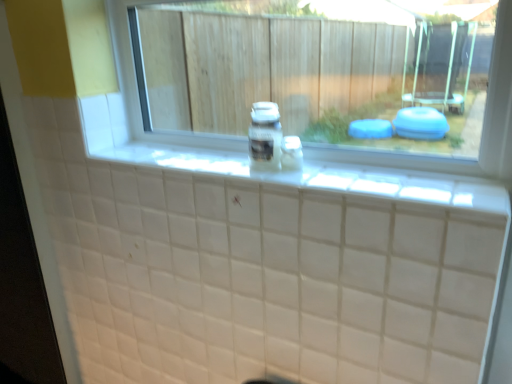
Question: Is clear plastic bottle at center not close to white tile ledge at center?

Choices:
 (A) no
 (B) yes

Answer: (A)

Question: From the image's perspective, would you say clear plastic bottle at center is shown under white tile ledge at center?

Choices:
 (A) yes
 (B) no

Answer: (B)

Question: Is white tile ledge at center a part of clear plastic bottle at center?

Choices:
 (A) yes
 (B) no

Answer: (B)

Question: Is the depth of clear plastic bottle at center greater than that of white tile ledge at center?

Choices:
 (A) yes
 (B) no

Answer: (A)

Question: Is clear plastic bottle at center taller than white tile ledge at center?

Choices:
 (A) no
 (B) yes

Answer: (B)

Question: Is white tile ledge at center to the left or to the right of clear plastic bottle at center in the image?

Choices:
 (A) left
 (B) right

Answer: (B)

Question: Does point (181, 158) appear closer or farther from the camera than point (258, 122)?

Choices:
 (A) farther
 (B) closer

Answer: (A)

Question: Considering the positions of white tile ledge at center and clear plastic bottle at center in the image, is white tile ledge at center taller or shorter than clear plastic bottle at center?

Choices:
 (A) tall
 (B) short

Answer: (B)

Question: From a real-world perspective, is white tile ledge at center physically located above or below clear plastic bottle at center?

Choices:
 (A) below
 (B) above

Answer: (A)

Question: Considering the positions of point (258, 140) and point (126, 86), is point (258, 140) closer or farther from the camera than point (126, 86)?

Choices:
 (A) farther
 (B) closer

Answer: (B)

Question: Considering their positions, is clear plastic bottle at center located in front of or behind transparent glass window at center?

Choices:
 (A) behind
 (B) front

Answer: (A)

Question: In terms of size, does clear plastic bottle at center appear bigger or smaller than transparent glass window at center?

Choices:
 (A) big
 (B) small

Answer: (B)

Question: From a real-world perspective, relative to transparent glass window at center, is clear plastic bottle at center vertically above or below?

Choices:
 (A) above
 (B) below

Answer: (B)

Question: Which is correct: transparent glass window at center is inside clear plastic bottle at center, or outside of it?

Choices:
 (A) inside
 (B) outside

Answer: (B)

Question: In terms of height, does transparent glass window at center look taller or shorter compared to clear plastic bottle at center?

Choices:
 (A) tall
 (B) short

Answer: (A)